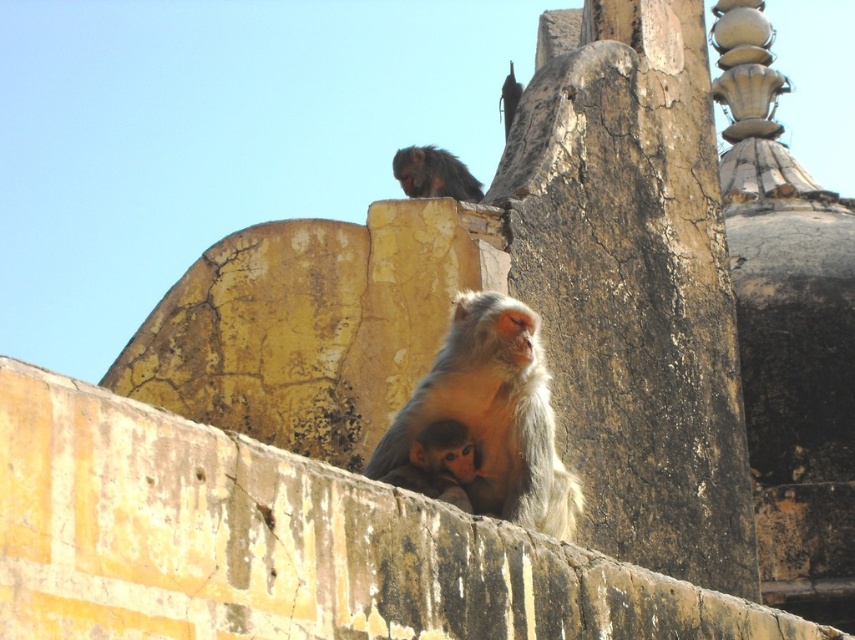
You are an anthropologist studying monkey behavior in ancient structures. You observe the golden fur monkey at center and the dark brown fur monkey at upper center. Which monkey is located lower in the scene?

The golden fur monkey at center is positioned under the dark brown fur monkey at upper center, so it is located lower in the scene.

You are a tourist standing in front of the ancient structure. You see two monkeys at the center of the wall. Which monkey is closer to you, the golden fur monkey at center or the light brown fur monkey at center?

The golden fur monkey at center is closer to you because the light brown fur monkey at center is behind it.